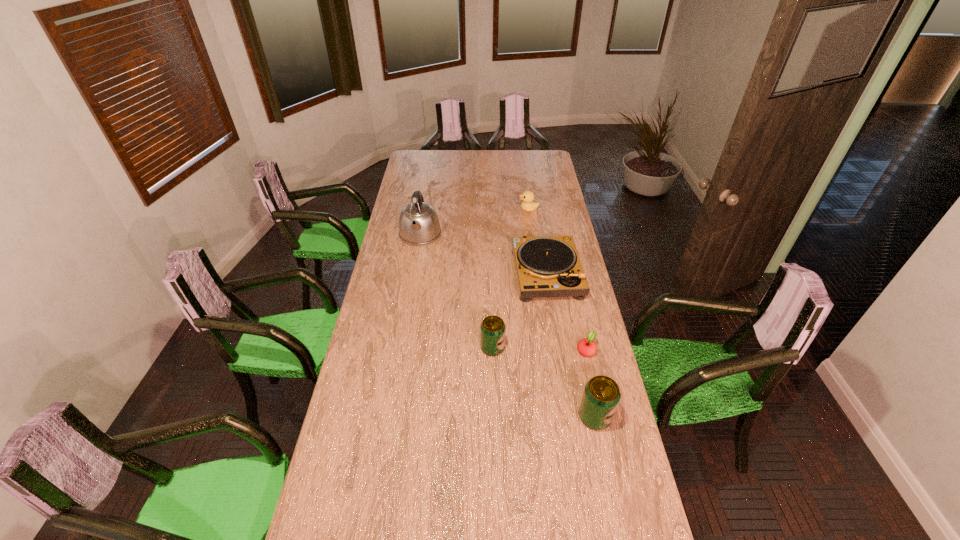
The image size is (960, 540). Identify the location of free space that satisfies the following two spatial constraints: 1. on the spout of the record player; 2. on the right side of the kettle. (414, 273).

Locate an element on the screen. The image size is (960, 540). free space that satisfies the following two spatial constraints: 1. on the spout of the record player; 2. on the right side of the tallest object is located at coordinates (414, 273).

This screenshot has width=960, height=540. What are the coordinates of `vacant space that satisfies the following two spatial constraints: 1. on the face of the nearest object; 2. on the left side of the duck` in the screenshot? It's located at (559, 417).

At what (x,y) coordinates should I click in order to perform the action: click on free space that satisfies the following two spatial constraints: 1. on the face of the farthest object; 2. on the back side of the apple. Please return your answer as a coordinate pair (x, y). Image resolution: width=960 pixels, height=540 pixels. Looking at the image, I should click on (549, 350).

Where is `vacant area that satisfies the following two spatial constraints: 1. on the spout of the leftmost object; 2. on the right side of the shortest object`? The height and width of the screenshot is (540, 960). vacant area that satisfies the following two spatial constraints: 1. on the spout of the leftmost object; 2. on the right side of the shortest object is located at coordinates (400, 350).